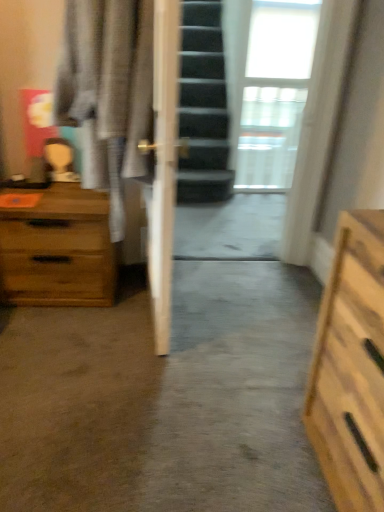
Locate an element on the screen. empty space that is ontop of wooden chest of drawers at left (from a real-world perspective) is located at coordinates (43, 192).